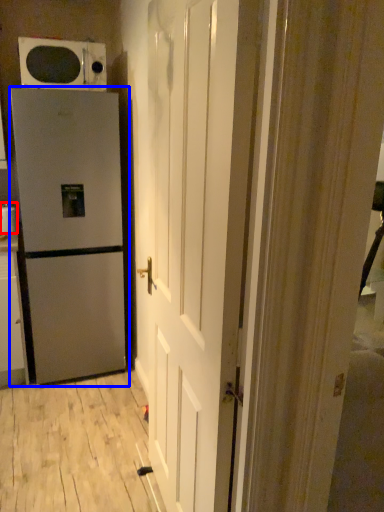
Question: Which point is further to the camera, appliance (highlighted by a red box) or refrigerator (highlighted by a blue box)?

Choices:
 (A) appliance
 (B) refrigerator

Answer: (A)